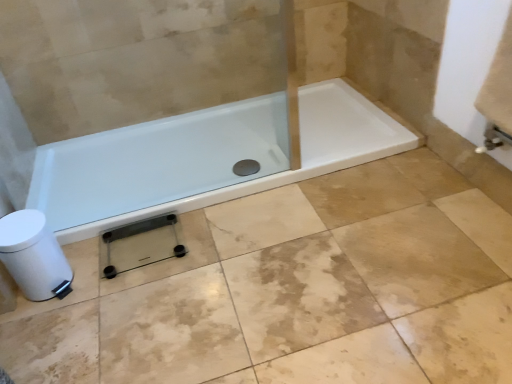
Where is `unoccupied region to the right of transparent glass scale at center`? unoccupied region to the right of transparent glass scale at center is located at coordinates (214, 250).